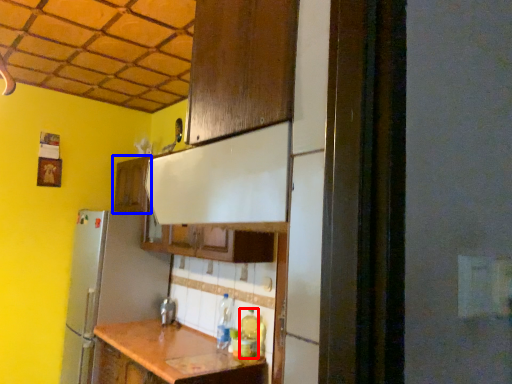
Question: Which point is closer to the camera, bottle (highlighted by a red box) or cabinetry (highlighted by a blue box)?

Choices:
 (A) bottle
 (B) cabinetry

Answer: (A)